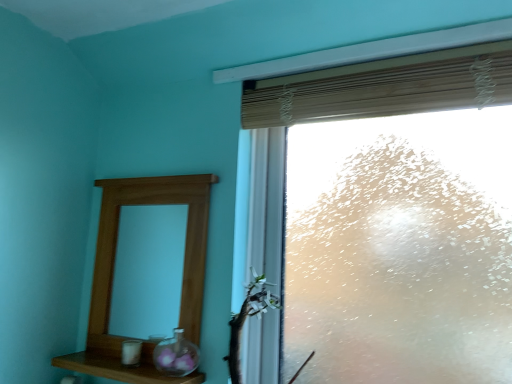
I want to click on empty space that is ontop of frosted glass window at upper right, so click(326, 127).